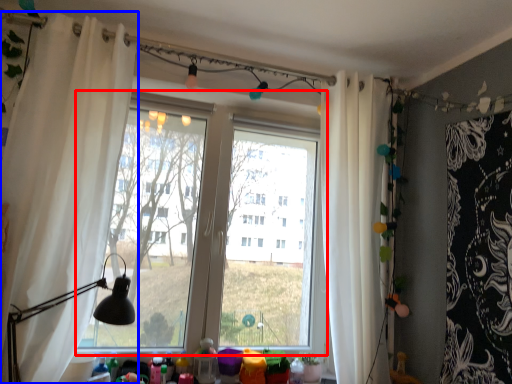
Question: Which of the following is the farthest to the observer, window (highlighted by a red box) or curtain (highlighted by a blue box)?

Choices:
 (A) window
 (B) curtain

Answer: (A)